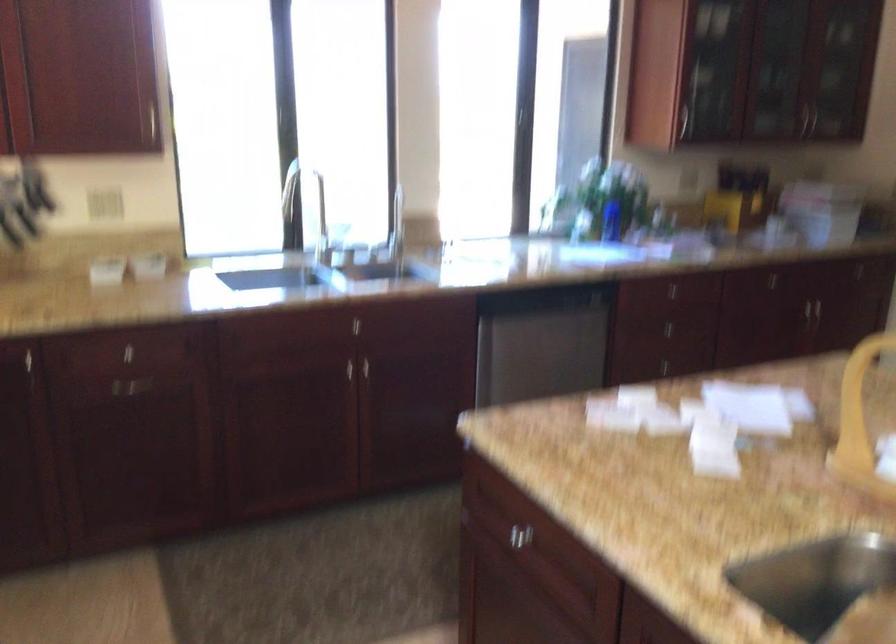
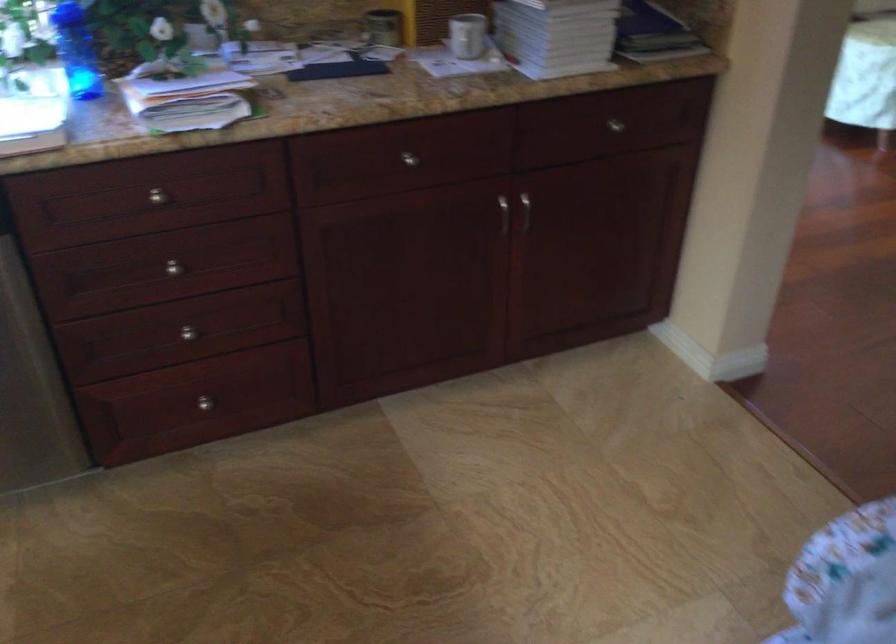
Locate, in the second image, the point that corresponds to pixel 698 281 in the first image.

(156, 196)